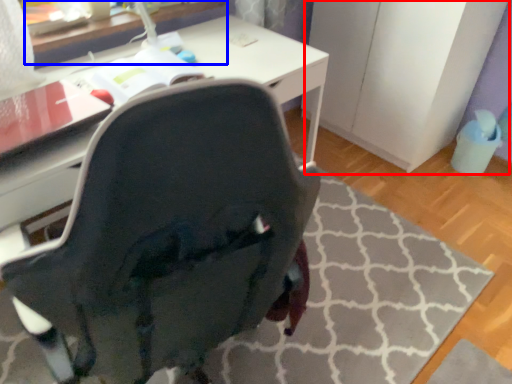
Question: Among these objects, which one is nearest to the camera, file cabinet (highlighted by a red box) or table (highlighted by a blue box)?

Choices:
 (A) file cabinet
 (B) table

Answer: (B)